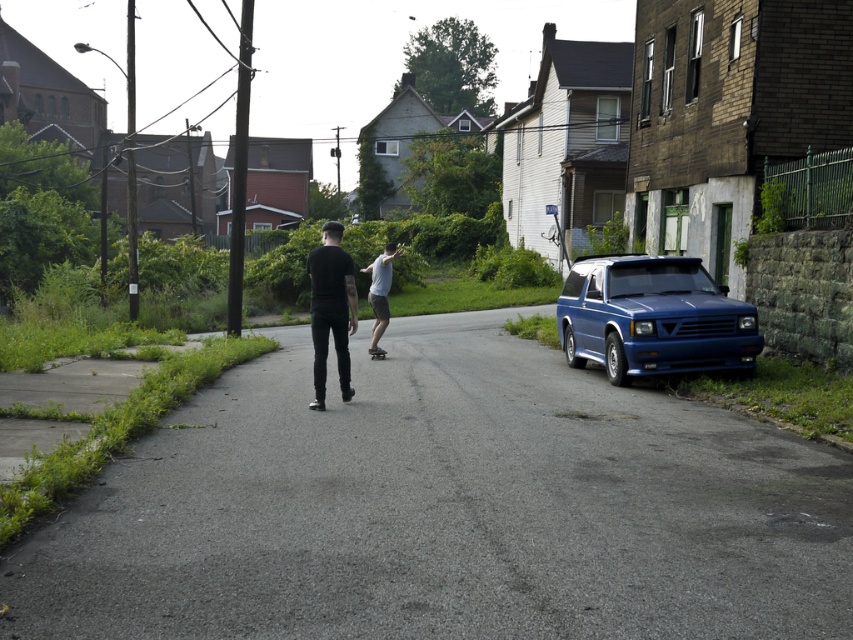
Does blue metallic suv at right come in front of light gray smooth skateboard at center?

Yes, blue metallic suv at right is closer to the viewer.

What do you see at coordinates (653, 317) in the screenshot?
I see `blue metallic suv at right` at bounding box center [653, 317].

Where is `blue metallic suv at right`? blue metallic suv at right is located at coordinates (653, 317).

In the scene shown: Who is lower down, black matte pants at center or light gray smooth skateboard at center?

black matte pants at center is lower down.

Does black matte pants at center have a greater height compared to light gray smooth skateboard at center?

No, black matte pants at center is not taller than light gray smooth skateboard at center.

Find the location of a particular element. The image size is (853, 640). black matte pants at center is located at coordinates (331, 308).

This screenshot has width=853, height=640. Identify the location of black matte pants at center. (331, 308).

Is point (822, 579) farther from viewer compared to point (373, 352)?

That is False.

Who is higher up, smooth asphalt road at center or black smooth skateboard at center?

black smooth skateboard at center is above.

Is point (404, 508) farther from camera compared to point (378, 353)?

No, (404, 508) is closer to viewer.

I want to click on smooth asphalt road at center, so click(445, 508).